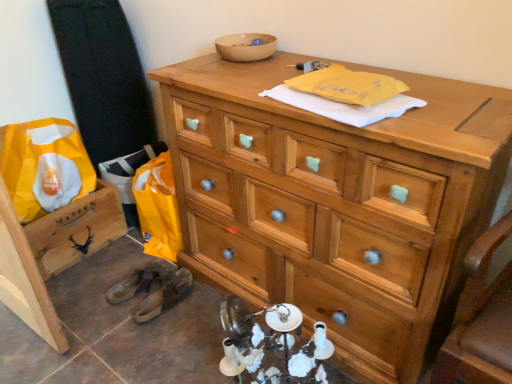
Find the location of a particular element. free point to the right of brown leather shoe at lower left, the 2th shoe when ordered from left to right is located at coordinates (201, 307).